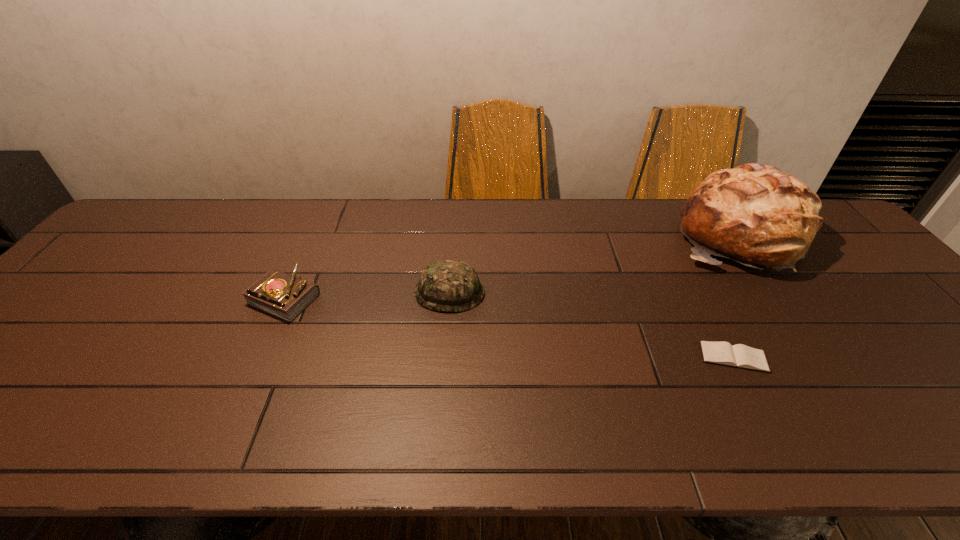
The height and width of the screenshot is (540, 960). I want to click on the tallest object, so click(x=755, y=214).

This screenshot has width=960, height=540. Find the location of `headwear`. headwear is located at coordinates (448, 285).

The width and height of the screenshot is (960, 540). I want to click on the third object from right to left, so click(448, 285).

Identify the location of the left diary. The image size is (960, 540). (285, 296).

Find the location of `the third tallest object`. the third tallest object is located at coordinates (285, 296).

The height and width of the screenshot is (540, 960). What are the coordinates of `the nearest object` in the screenshot? It's located at (723, 353).

Where is `the shorter diary`? the shorter diary is located at coordinates (723, 353).

Identify the location of free space located 0.250m on the front of the tallest object. The height and width of the screenshot is (540, 960). (820, 355).

The image size is (960, 540). I want to click on blank space located 0.070m on the back of the third shortest object, so click(452, 258).

The height and width of the screenshot is (540, 960). I want to click on vacant area situated on the right of the taller diary, so click(420, 297).